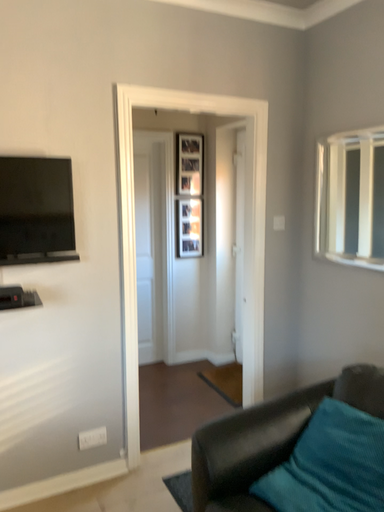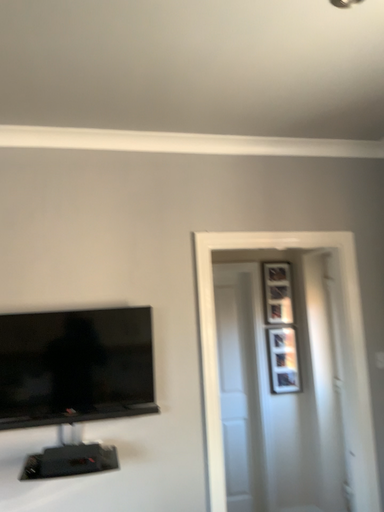
Question: How did the camera likely rotate when shooting the video?

Choices:
 (A) rotated left
 (B) rotated right

Answer: (A)